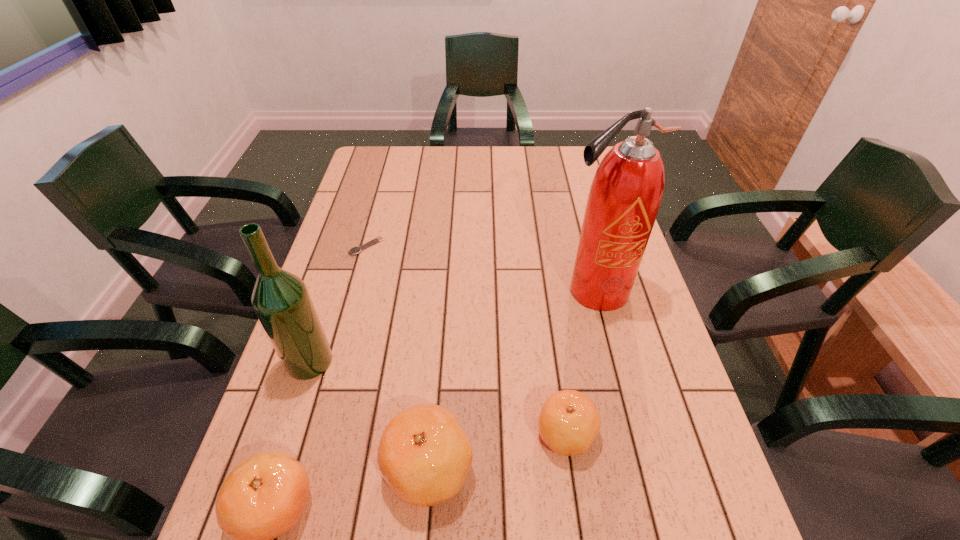
The width and height of the screenshot is (960, 540). What are the coordinates of `the second clementine from right to left` in the screenshot? It's located at (424, 455).

Locate an element on the screen. This screenshot has height=540, width=960. the rightmost clementine is located at coordinates (569, 422).

This screenshot has width=960, height=540. I want to click on the shortest clementine, so click(569, 422).

Image resolution: width=960 pixels, height=540 pixels. In order to click on watch in this screenshot , I will do `click(355, 250)`.

What are the coordinates of `the farthest object` in the screenshot? It's located at (355, 250).

The image size is (960, 540). Find the location of `the third farthest object`. the third farthest object is located at coordinates (280, 299).

At what (x,y) coordinates should I click in order to perform the action: click on the second tallest object. Please return your answer as a coordinate pair (x, y). The width and height of the screenshot is (960, 540). Looking at the image, I should click on (280, 299).

Identify the location of the second farthest object. (626, 192).

At what (x,y) coordinates should I click in order to perform the action: click on fire extinguisher. Please return your answer as a coordinate pair (x, y). Image resolution: width=960 pixels, height=540 pixels. Looking at the image, I should click on (626, 192).

Find the location of `free space located on the right of the third object from right to left`. free space located on the right of the third object from right to left is located at coordinates (525, 468).